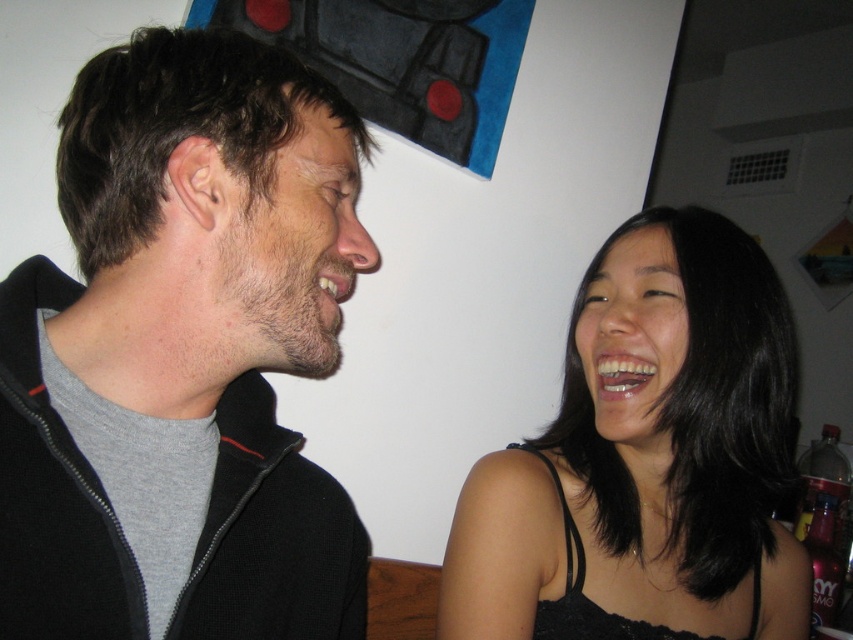
Question: Which point is farther from the camera taking this photo?

Choices:
 (A) (335, 211)
 (B) (715, 289)
 (C) (328, 548)

Answer: (B)

Question: Is black matte jacket at left below black satin tank top at right?

Choices:
 (A) no
 (B) yes

Answer: (A)

Question: Which object is the closest to the beige matte face at left?

Choices:
 (A) smooth skin face at center
 (B) black matte jacket at left

Answer: (B)

Question: Is beige matte face at left to the right of smooth skin face at center from the viewer's perspective?

Choices:
 (A) no
 (B) yes

Answer: (A)

Question: Which object is closer to the camera taking this photo?

Choices:
 (A) beige matte face at left
 (B) smooth skin face at center
 (C) black matte jacket at left

Answer: (C)

Question: In this image, where is black matte jacket at left located relative to black satin tank top at right?

Choices:
 (A) right
 (B) left

Answer: (B)